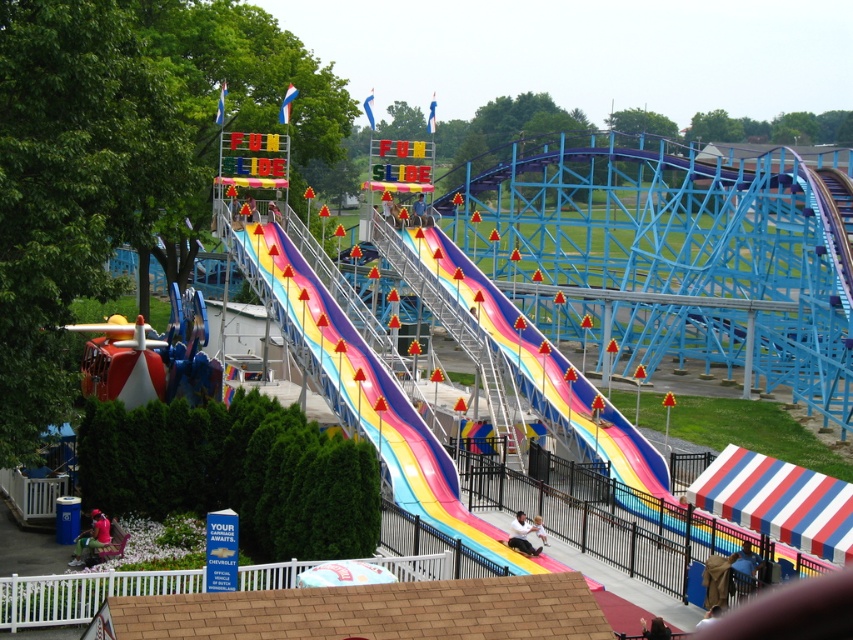
Question: Does rainbow striped slide at center appear over blue fabric umbrella at lower right?

Choices:
 (A) no
 (B) yes

Answer: (B)

Question: Which point is farther to the camera?

Choices:
 (A) rainbow striped slide at center
 (B) matte pink shirt at lower left
 (C) brown fabric bag at lower right

Answer: (A)

Question: Can you confirm if blue fabric umbrella at lower right is wider than matte pink shirt at lower left?

Choices:
 (A) no
 (B) yes

Answer: (A)

Question: Can you confirm if rainbow striped slide at center is wider than smooth white shirt at center?

Choices:
 (A) yes
 (B) no

Answer: (A)

Question: Which object is positioned farthest from the rainbow plastic slide at center?

Choices:
 (A) dark brown hair at upper center
 (B) smooth white shirt at center

Answer: (A)

Question: Which of the following is the farthest from the observer?

Choices:
 (A) brown fabric bag at lower right
 (B) rainbow striped slide at center
 (C) dark brown hair at upper center

Answer: (B)